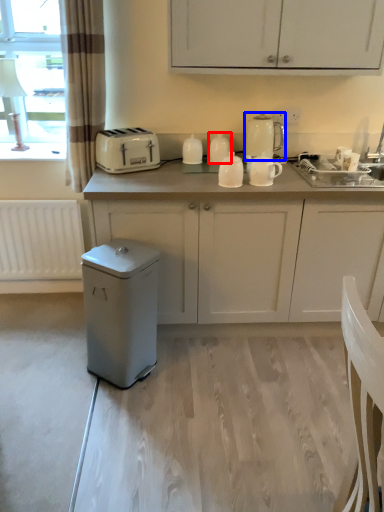
Question: Which of the following is the closest to the observer, kitchen appliance (highlighted by a red box) or kitchen appliance (highlighted by a blue box)?

Choices:
 (A) kitchen appliance
 (B) kitchen appliance

Answer: (B)